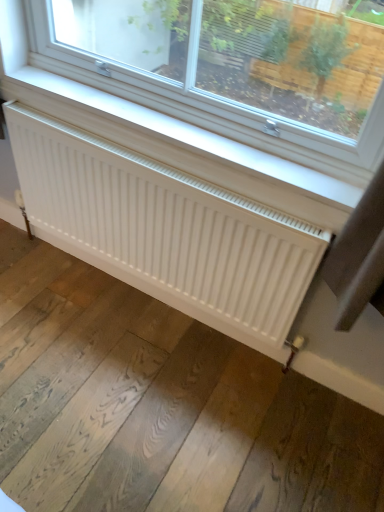
At what (x,y) coordinates should I click in order to perform the action: click on free location to the left of white matte radiator at lower center. Please return your answer as a coordinate pair (x, y). Looking at the image, I should click on coord(59,298).